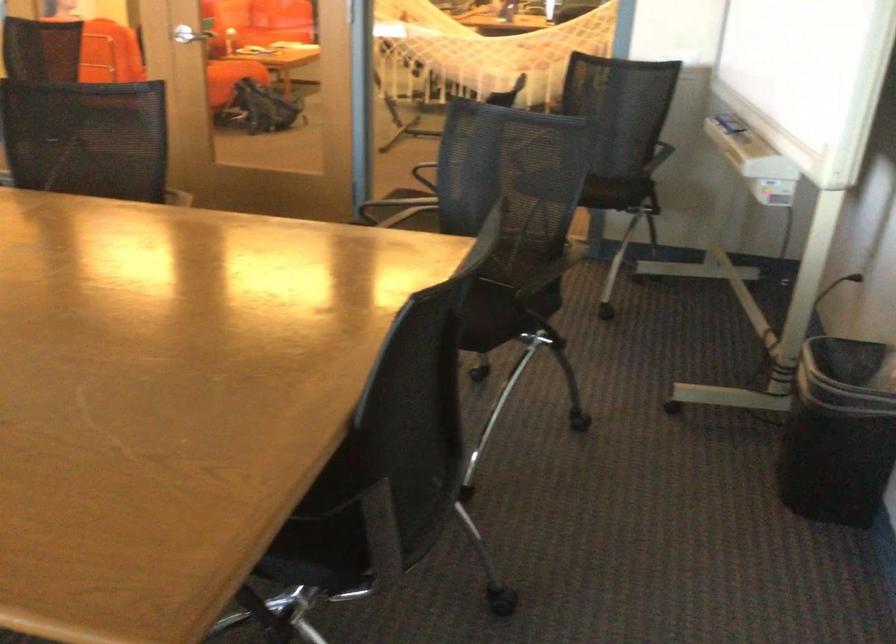
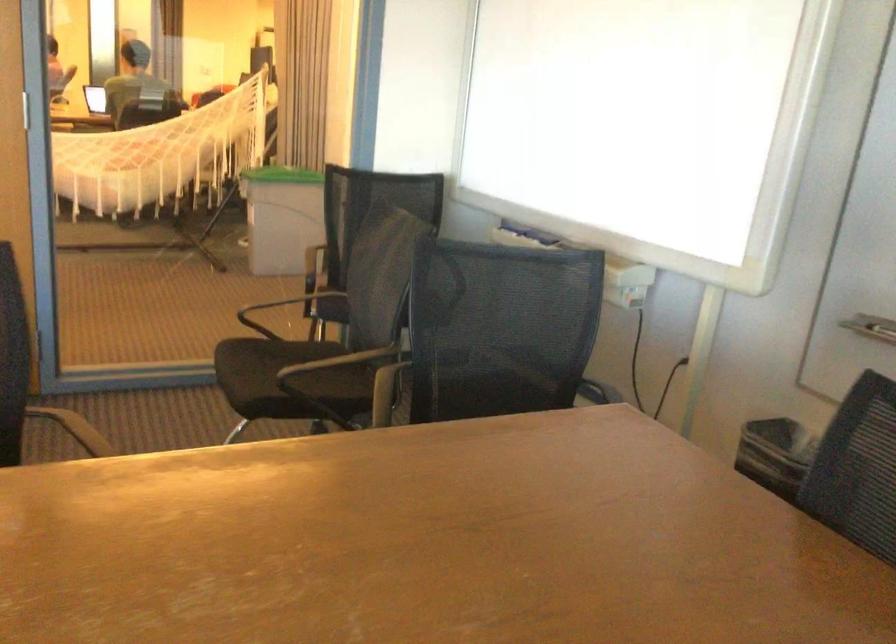
Find the pixel in the second image that matches point (512, 185) in the first image.

(501, 328)